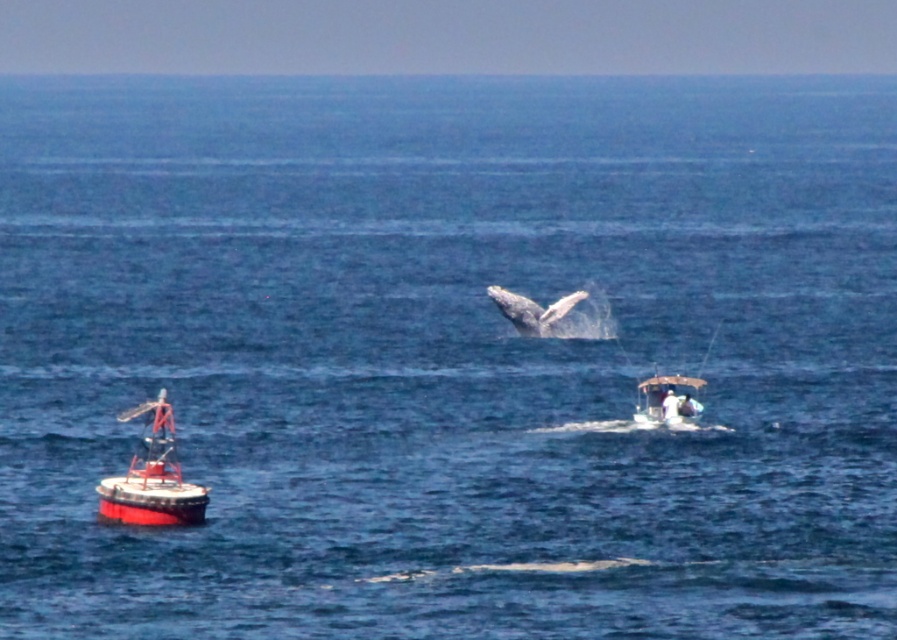
You are a marine biologist observing the ocean scene. You need to determine the relative sizes of the wooden boat at center and the gray matte whale at center. Which object is smaller?

The wooden boat at center is shorter than the gray matte whale at center, so the wooden boat at center is smaller.

You are a marine biologist observing the ocean scene. You need to determine if the wooden boat at center can safely approach the gray matte whale at center without violating the 15 meters safety distance rule. Can they approach within 15 meters?

The wooden boat at center is currently 16.21 meters away from the gray matte whale at center. Since 16.21 meters is greater than the 15 meters safety distance, the boat can approach closer but must maintain at least 15 meters distance to comply with the rule.